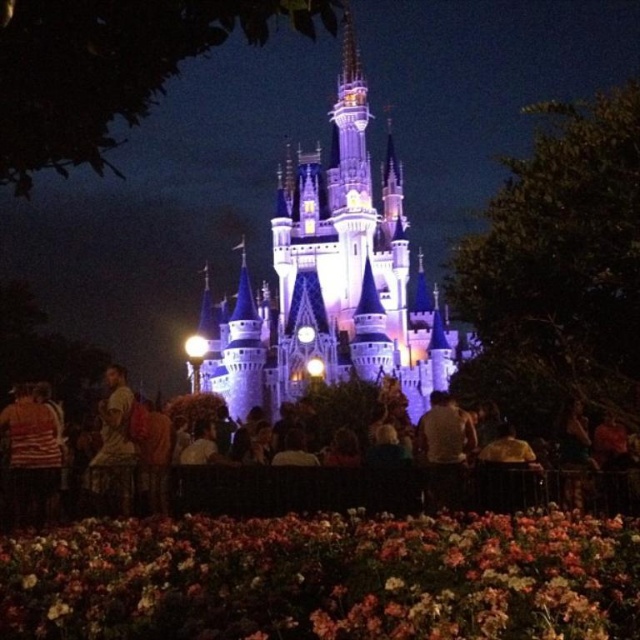
You are standing in the theme park and want to take a photo of the castle. You notice two points marked in the scene. Which point, point (141, 616) or point (124, 419), is closer to you?

Point (141, 616) is closer to the viewer than point (124, 419).